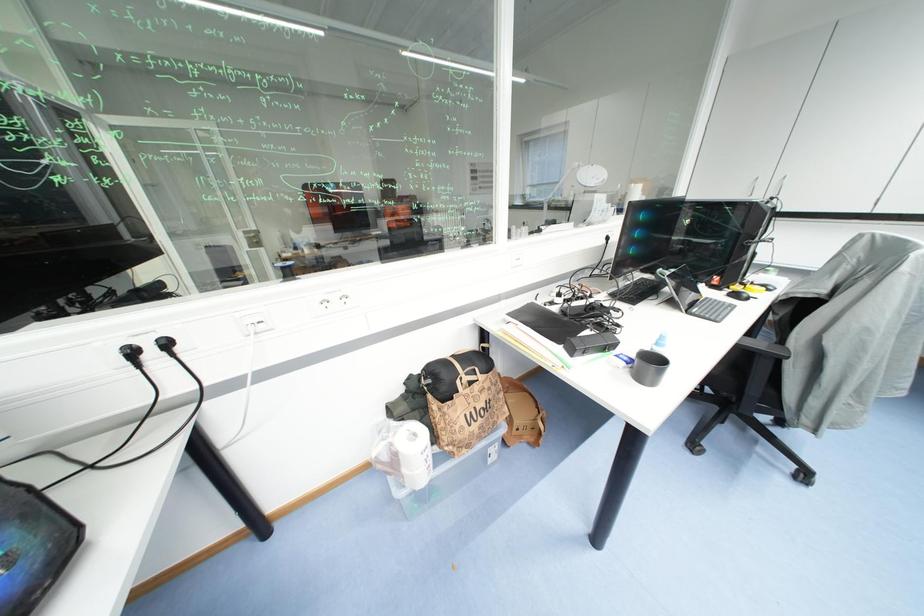
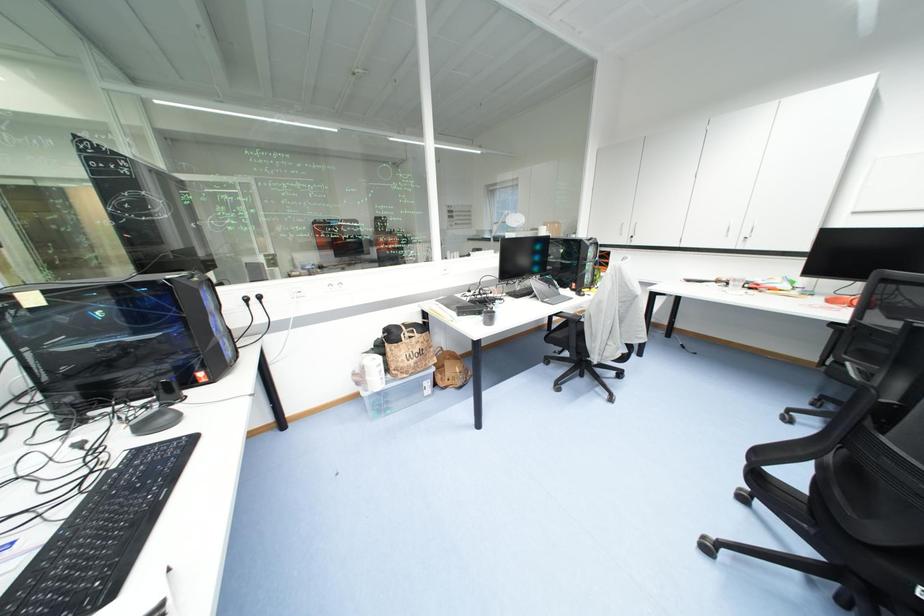
What movement of the cameraman would produce the second image?

The cameraman walked toward right, backward.